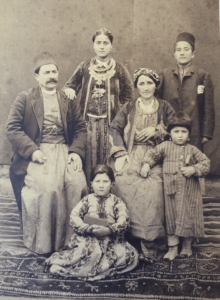
You are a GUI agent. You are given a task and a screenshot of the screen. Output one action in this format:
    pyautogui.click(x=<x>, y=<y>)
    Task: Click on the book
    This screenshot has width=220, height=300.
    Given the screenshot: What is the action you would take?
    pyautogui.click(x=190, y=162), pyautogui.click(x=99, y=220)